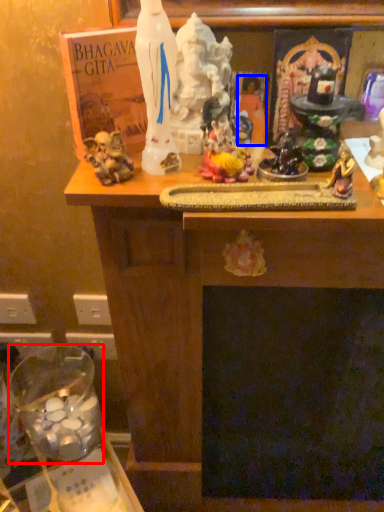
Question: Which of the following is the farthest to the observer, glass jar (highlighted by a red box) or person (highlighted by a blue box)?

Choices:
 (A) glass jar
 (B) person

Answer: (A)